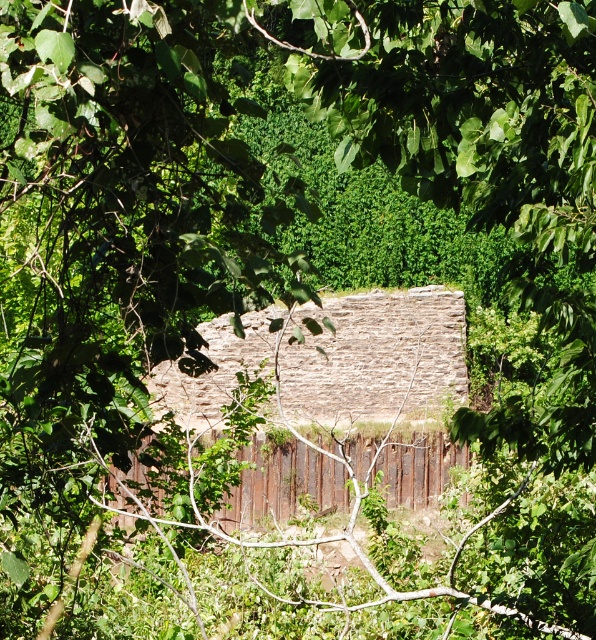
Can you confirm if rustic stone hut at center is positioned above rusty metal fence at center?

Yes, rustic stone hut at center is above rusty metal fence at center.

Is rustic stone hut at center wider than rusty metal fence at center?

Yes.

Find the location of a particular element. rustic stone hut at center is located at coordinates (383, 381).

Where is `rustic stone hut at center`? The height and width of the screenshot is (640, 596). rustic stone hut at center is located at coordinates (383, 381).